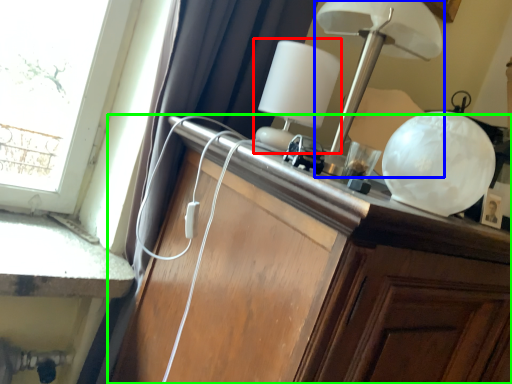
Question: Which object is positioned farthest from table lamp (highlighted by a red box)? Select from lamp (highlighted by a blue box) and cabinetry (highlighted by a green box).

Choices:
 (A) lamp
 (B) cabinetry

Answer: (B)